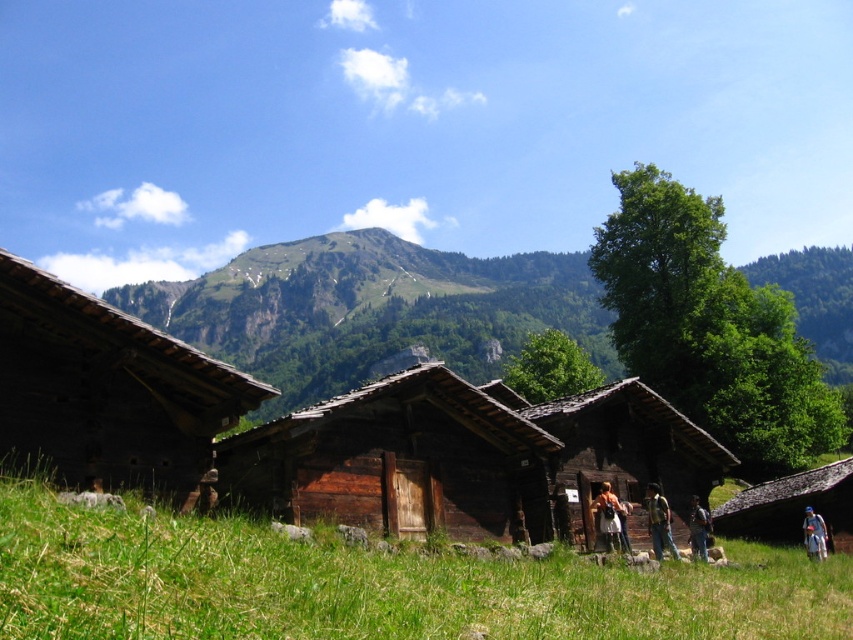
Which of these two, wooden cabin at lower right or brown leather jacket at lower right, stands shorter?

brown leather jacket at lower right is shorter.

Does wooden cabin at lower right appear on the left side of brown leather jacket at lower right?

Incorrect, wooden cabin at lower right is not on the left side of brown leather jacket at lower right.

Is point (824, 483) positioned behind point (695, 516)?

Yes, point (824, 483) is farther from viewer.

In order to click on wooden cabin at lower right in this screenshot , I will do `click(792, 508)`.

Can you confirm if brown leather jacket at center is thinner than brown leather jacket at lower right?

In fact, brown leather jacket at center might be wider than brown leather jacket at lower right.

Which of these two, brown leather jacket at center or brown leather jacket at lower right, stands shorter?

brown leather jacket at lower right is shorter.

Is point (602, 500) behind point (701, 532)?

That is False.

Image resolution: width=853 pixels, height=640 pixels. Identify the location of brown leather jacket at center. (608, 518).

Does brown wooden hut at center appear on the left side of wooden cabin at lower right?

Yes, brown wooden hut at center is to the left of wooden cabin at lower right.

Measure the distance from brown wooden hut at center to wooden cabin at lower right.

12.39 meters

Where is `brown wooden hut at center`? brown wooden hut at center is located at coordinates (462, 456).